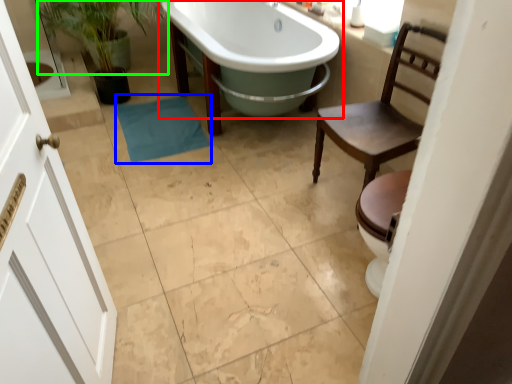
Question: Which is nearer to the bathtub (highlighted by a red box)? bath towel (highlighted by a blue box) or plant (highlighted by a green box).

Choices:
 (A) bath towel
 (B) plant

Answer: (A)